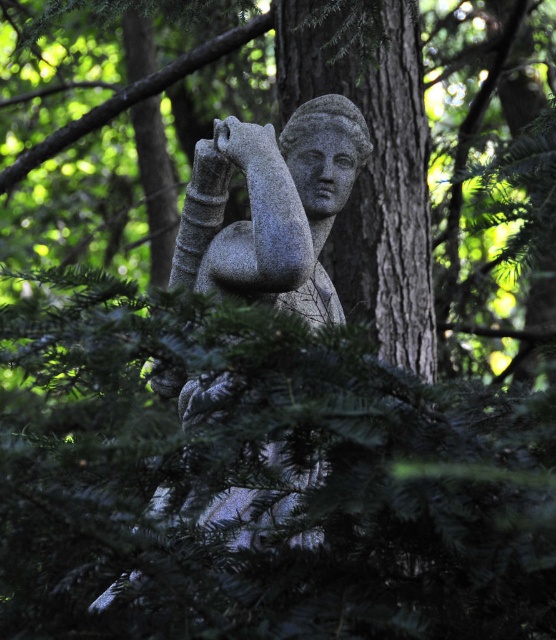
You are standing in a forest and see a stone statue partially hidden by green plants. There is a point marked at coordinates [371,161]. What does this point represent?

The point at [371,161] marks the gray stone tree trunk at center.

You are an artist planning to sketch the scene. You need to place the gray stone tree trunk at center and the granite statue at center in your drawing. According to the scene, which object should you draw to the right side of the other?

The gray stone tree trunk at center should be drawn to the right of the granite statue at center.